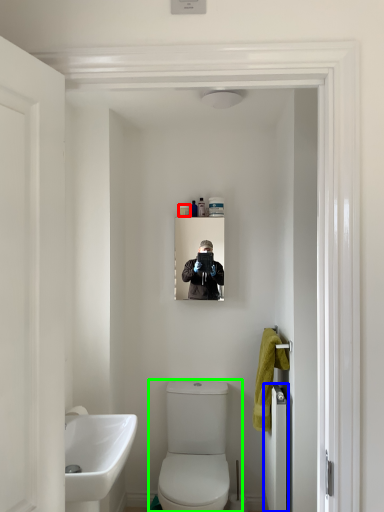
Question: Estimate the real-world distances between objects in this image. Which object is farther from toiletry (highlighted by a red box), door (highlighted by a blue box) or toilet (highlighted by a green box)?

Choices:
 (A) door
 (B) toilet

Answer: (A)